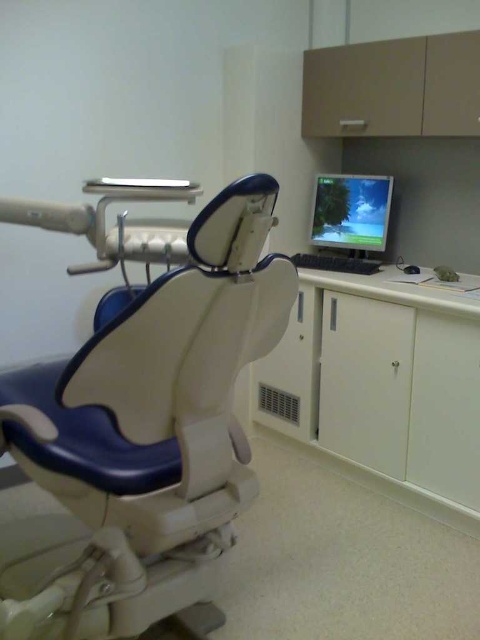
Question: Among these points, which one is farthest from the camera?

Choices:
 (A) (187, 284)
 (B) (397, 380)

Answer: (B)

Question: Is white glossy cabinet at lower right wider than matte plastic monitor at upper right?

Choices:
 (A) no
 (B) yes

Answer: (B)

Question: Does white glossy cabinet at lower right come in front of matte plastic monitor at upper right?

Choices:
 (A) yes
 (B) no

Answer: (A)

Question: Which object is the closest to the white glossy cabinet at lower right?

Choices:
 (A) matte plastic monitor at upper right
 (B) white leather swivel chair at left

Answer: (A)

Question: Which object appears closest to the camera in this image?

Choices:
 (A) white glossy cabinet at lower right
 (B) matte plastic monitor at upper right

Answer: (A)

Question: Does white leather swivel chair at left appear on the right side of matte plastic monitor at upper right?

Choices:
 (A) yes
 (B) no

Answer: (B)